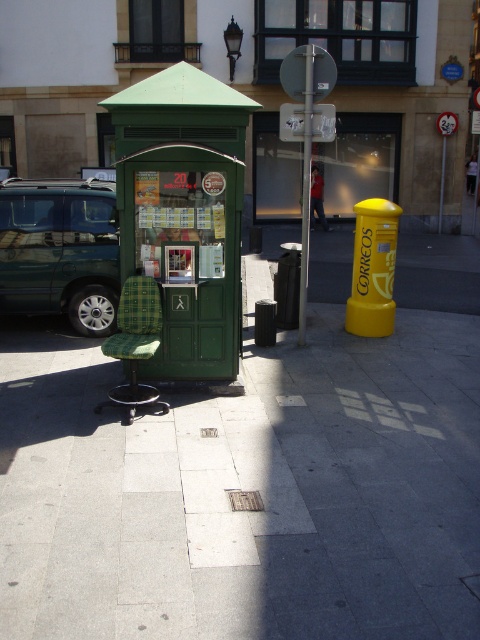
Question: Does smooth concrete pavement at center appear over metallic silver pole at center?

Choices:
 (A) yes
 (B) no

Answer: (B)

Question: Which point appears closest to the camera in this image?

Choices:
 (A) (45, 582)
 (B) (213, 100)

Answer: (A)

Question: Is metallic green van at left to the right of metallic silver pole at center from the viewer's perspective?

Choices:
 (A) yes
 (B) no

Answer: (B)

Question: Is green matte bus stop at center below metallic silver pole at center?

Choices:
 (A) yes
 (B) no

Answer: (A)

Question: Which of the following is the closest to the observer?

Choices:
 (A) (36, 237)
 (B) (204, 314)
 (C) (304, 230)

Answer: (B)

Question: Which of the following is the closest to the observer?

Choices:
 (A) (302, 320)
 (B) (232, 545)

Answer: (B)